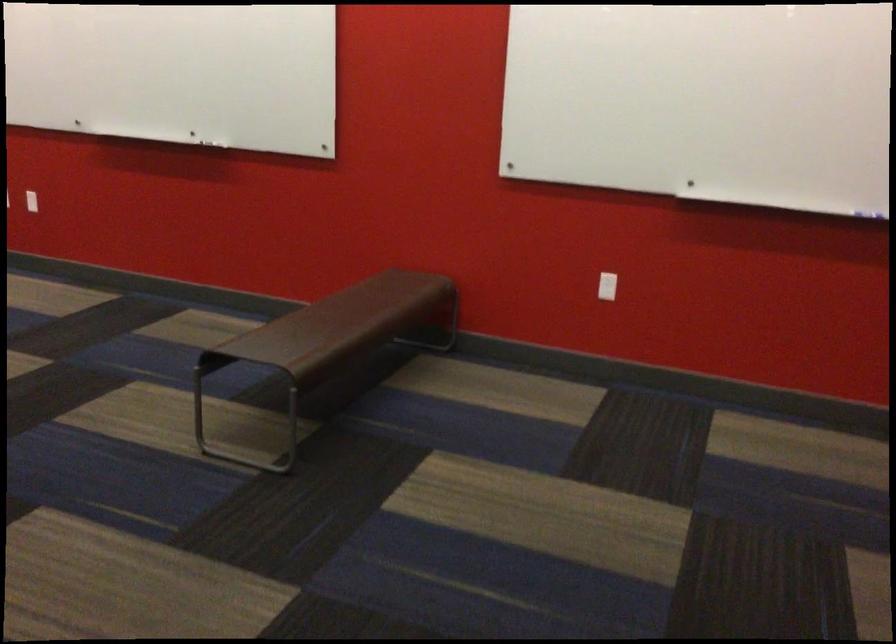
The location [607,286] corresponds to which object?

This point indicates the white light switch.